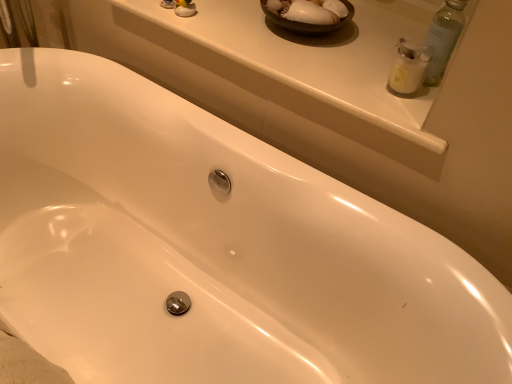
The image size is (512, 384). Describe the element at coordinates (307, 68) in the screenshot. I see `white glossy window sill at upper center` at that location.

Find the location of a particular element. white glossy window sill at upper center is located at coordinates click(x=307, y=68).

What is the approximate width of white glossy window sill at upper center?

It is 21.73 inches.

Where is `white matte jar at upper right`? The image size is (512, 384). white matte jar at upper right is located at coordinates (408, 68).

What do you see at coordinates (408, 68) in the screenshot? I see `white matte jar at upper right` at bounding box center [408, 68].

Identify the location of white glossy window sill at upper center. (307, 68).

Does white matte jar at upper right appear on the left side of white glossy window sill at upper center?

Incorrect, white matte jar at upper right is not on the left side of white glossy window sill at upper center.

Which object is further away from the camera taking this photo, white matte jar at upper right or white glossy window sill at upper center?

white matte jar at upper right is further from the camera.

Is point (400, 58) farther from camera compared to point (237, 31)?

No, it is in front of (237, 31).

From the image's perspective, is white matte jar at upper right on white glossy window sill at upper center?

No, from the image's perspective, white matte jar at upper right is not on top of white glossy window sill at upper center.

From a real-world perspective, relative to white glossy window sill at upper center, is white matte jar at upper right vertically above or below?

In terms of real-world spatial position, white matte jar at upper right is above white glossy window sill at upper center.

Considering the sizes of white matte jar at upper right and white glossy window sill at upper center in the image, is white matte jar at upper right wider or thinner than white glossy window sill at upper center?

Considering their sizes, white matte jar at upper right looks slimmer than white glossy window sill at upper center.

Can you confirm if white matte jar at upper right is shorter than white glossy window sill at upper center?

Incorrect, the height of white matte jar at upper right does not fall short of that of white glossy window sill at upper center.

Looking at the image, does white matte jar at upper right seem bigger or smaller compared to white glossy window sill at upper center?

Clearly, white matte jar at upper right is smaller in size than white glossy window sill at upper center.

Is white glossy window sill at upper center surrounded by white matte jar at upper right?

That's incorrect, white glossy window sill at upper center is not inside white matte jar at upper right.

Is white matte jar at upper right positioned far away from white glossy window sill at upper center?

No, white matte jar at upper right is in close proximity to white glossy window sill at upper center.

Is white matte jar at upper right oriented away from white glossy window sill at upper center?

No, white matte jar at upper right is not facing the opposite direction of white glossy window sill at upper center.

How many degrees apart are the facing directions of white matte jar at upper right and white glossy window sill at upper center?

There is a 6.77-degree angle between the facing directions of white matte jar at upper right and white glossy window sill at upper center.

How distant is white matte jar at upper right from white glossy window sill at upper center?

white matte jar at upper right is 11.02 inches from white glossy window sill at upper center.

Where is `window sill directly beneath the white matte jar at upper right (from a real-world perspective)`? window sill directly beneath the white matte jar at upper right (from a real-world perspective) is located at coordinates (307, 68).

Can you confirm if white glossy window sill at upper center is positioned to the left of white matte jar at upper right?

Yes, white glossy window sill at upper center is to the left of white matte jar at upper right.

In the image, is white glossy window sill at upper center positioned in front of or behind white matte jar at upper right?

Visually, white glossy window sill at upper center is located in front of white matte jar at upper right.

Which is in front, point (241, 42) or point (398, 77)?

The point (398, 77) is closer.

From the image's perspective, is white glossy window sill at upper center located above or below white matte jar at upper right?

Clearly, from the image's perspective, white glossy window sill at upper center is above white matte jar at upper right.

From a real-world perspective, is white glossy window sill at upper center below white matte jar at upper right?

Yes.

Is white glossy window sill at upper center wider or thinner than white matte jar at upper right?

Considering their sizes, white glossy window sill at upper center looks broader than white matte jar at upper right.

Does white glossy window sill at upper center have a greater height compared to white matte jar at upper right?

No, white glossy window sill at upper center is not taller than white matte jar at upper right.

In the scene shown: Does white glossy window sill at upper center have a larger size compared to white matte jar at upper right?

Yes.

Do you think white glossy window sill at upper center is within white matte jar at upper right, or outside of it?

white glossy window sill at upper center is located beyond the bounds of white matte jar at upper right.

Is white glossy window sill at upper center in contact with white matte jar at upper right?

No, white glossy window sill at upper center is not next to white matte jar at upper right.

Looking at this image, is white glossy window sill at upper center facing away from white matte jar at upper right?

That's not correct — white glossy window sill at upper center is not looking away from white matte jar at upper right.

What's the angular difference between white glossy window sill at upper center and white matte jar at upper right's facing directions?

6.77 degrees.

In the image, there is a white matte jar at upper right. Identify the location of window sill below it (from a real-world perspective). This screenshot has height=384, width=512. (307, 68).

This screenshot has width=512, height=384. What are the coordinates of `cleaning product on the right of white glossy window sill at upper center` in the screenshot? It's located at (408, 68).

Locate an element on the screen. The width and height of the screenshot is (512, 384). cleaning product below the white glossy window sill at upper center (from the image's perspective) is located at coordinates (408, 68).